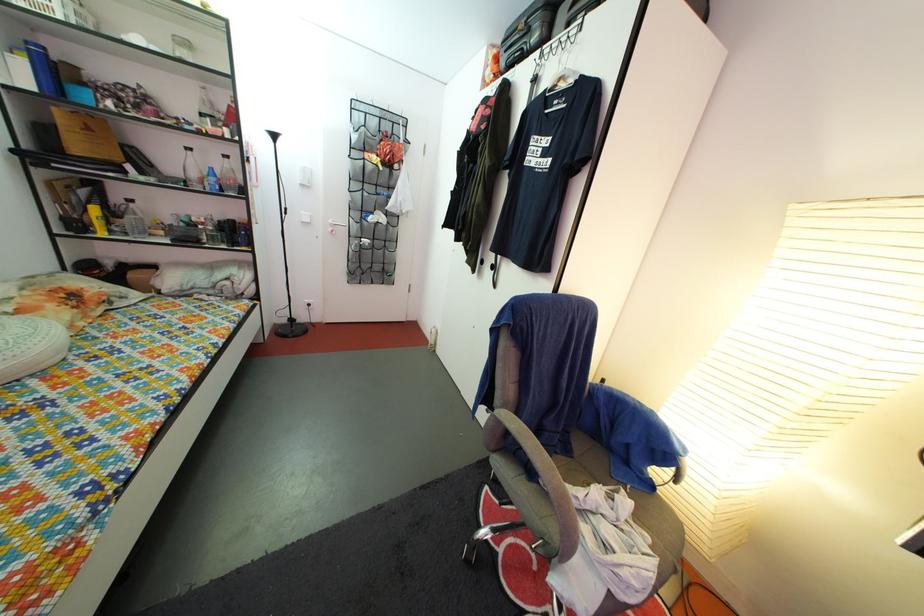
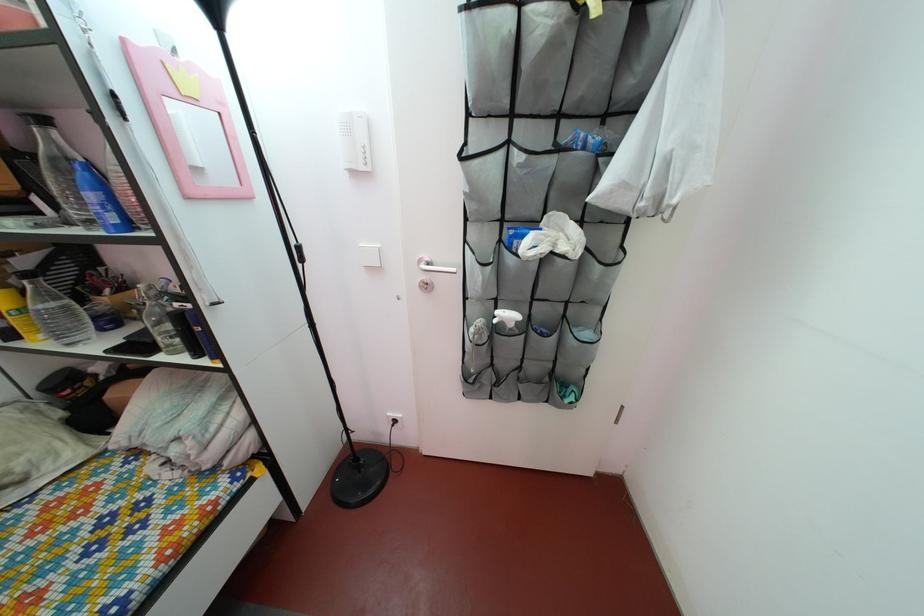
The point at (92, 201) is marked in the first image. Where is the corresponding point in the second image?

(32, 270)